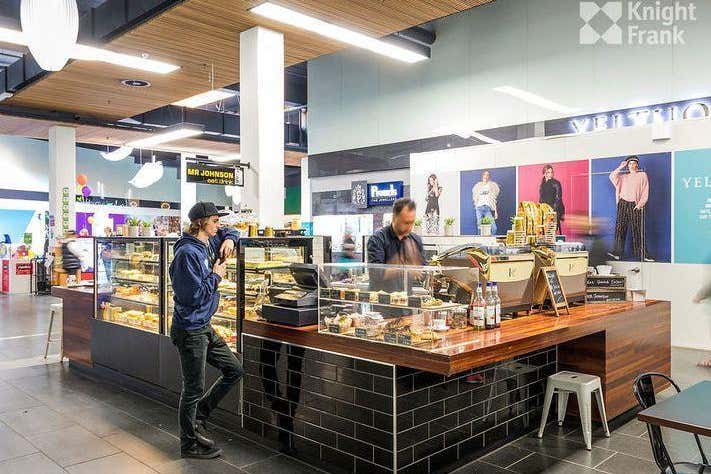
Find the location of a particular element. floor is located at coordinates (85, 439), (549, 452).